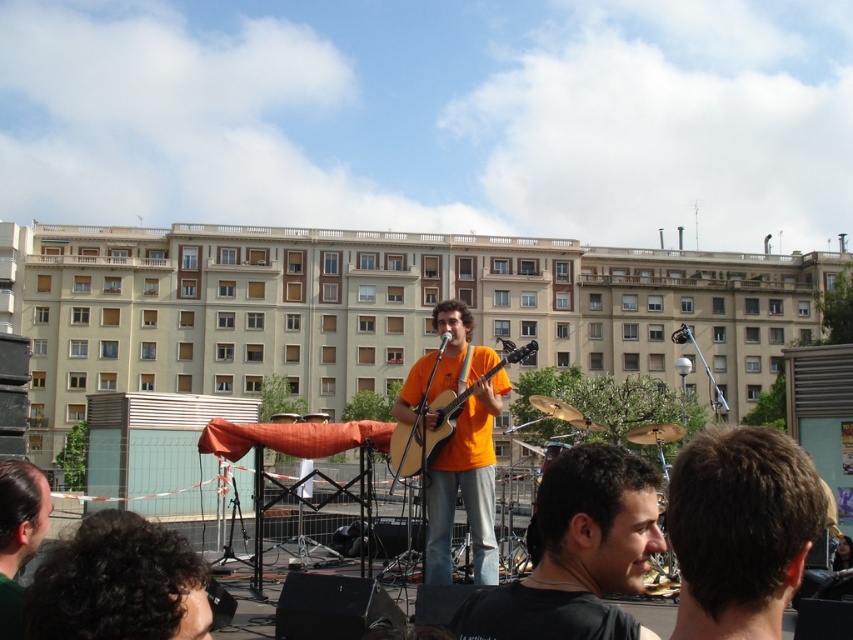
Question: Which object is closer to the camera taking this photo?

Choices:
 (A) dark brown hair at lower left
 (B) black matte shirt at lower right
 (C) acoustic wood guitar at center
 (D) orange matte guitar at center

Answer: (B)

Question: Is the position of black matte shirt at lower right less distant than that of dark brown hair at lower left?

Choices:
 (A) no
 (B) yes

Answer: (B)

Question: Which point is farther from the camera taking this photo?

Choices:
 (A) (480, 394)
 (B) (395, 472)

Answer: (A)

Question: Considering the real-world distances, which object is closest to the orange matte guitar at center?

Choices:
 (A) curly hair at lower left
 (B) black matte shirt at lower right
 (C) dark brown hair at lower left
 (D) dark brown hair at center

Answer: (B)

Question: Is black matte shirt at lower right thinner than dark brown hair at lower left?

Choices:
 (A) no
 (B) yes

Answer: (A)

Question: Is black matte shirt at lower right closer to camera compared to acoustic wood guitar at center?

Choices:
 (A) yes
 (B) no

Answer: (A)